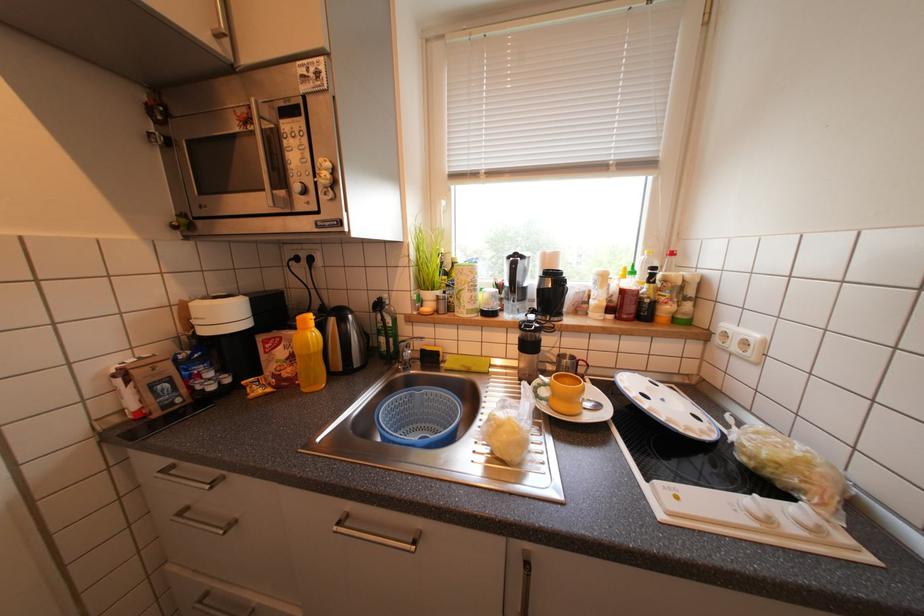
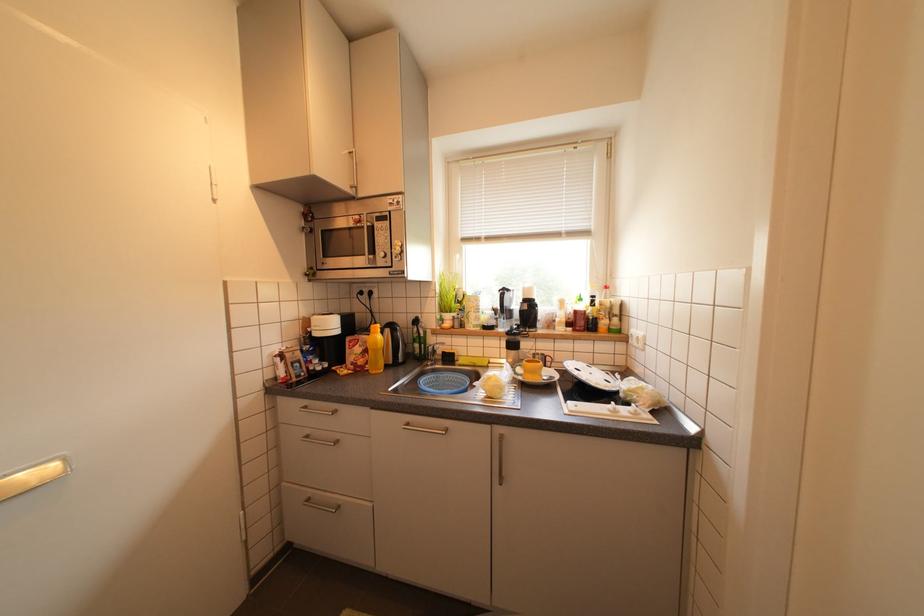
Question: In a continuous first-person perspective shot, in which direction is the camera moving?

Choices:
 (A) Left
 (B) Right
 (C) Forward
 (D) Backward

Answer: (D)